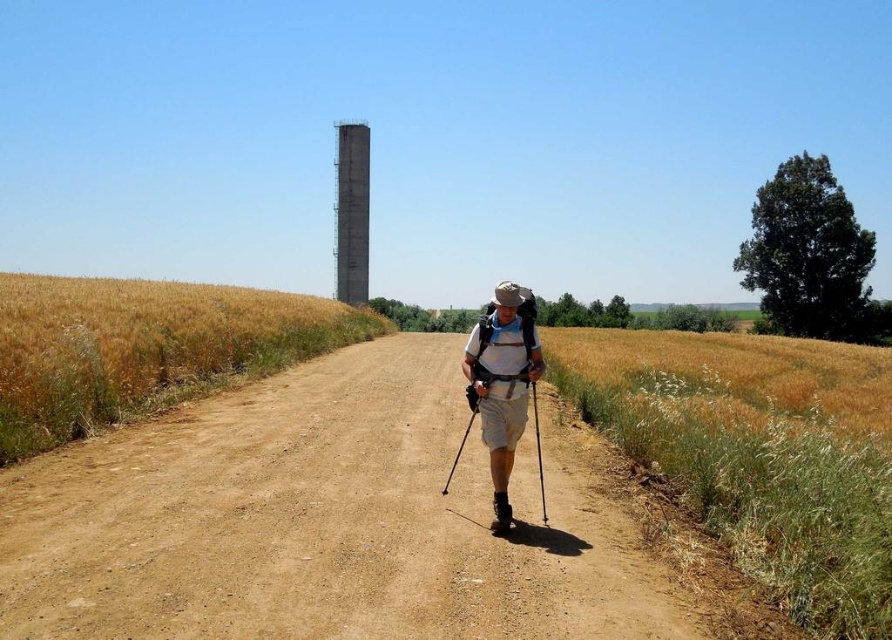
You are a hiker standing on the dirt road at center and want to reach the matte khaki shorts at center. Which direction should you move to get closer to the shorts?

The matte khaki shorts at center are further away from the viewer than the dirt road at center. To reach them, you should move forward along the dirt road at center towards the shorts.

You are a hiker trying to cross the dirt road at center and the golden wheat field at left. Which path is narrower?

The dirt road at center is narrower than the golden wheat field at left.

You are standing on the dirt road at center and want to walk towards the matte khaki shorts at center. Which direction should you face?

You should face to the right because the dirt road at center is to the left of matte khaki shorts at center, so moving towards the shorts would require facing right.